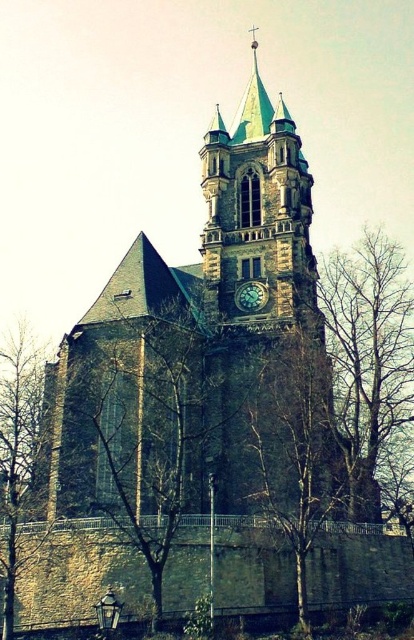
Question: Which object appears farthest from the camera in this image?

Choices:
 (A) bare wood tree at center
 (B) dark gray stone church at center

Answer: (B)

Question: From the image, what is the correct spatial relationship of dark gray stone church at center in relation to bare wood tree at center?

Choices:
 (A) above
 (B) below

Answer: (A)

Question: Among these objects, which one is nearest to the camera?

Choices:
 (A) dark gray stone church at center
 (B) green leafy tree at center
 (C) gold textured clock at center
 (D) bare wood tree at center

Answer: (B)

Question: Does bare wood tree at center have a greater width compared to bare branches at left?

Choices:
 (A) no
 (B) yes

Answer: (A)

Question: Considering the relative positions of green leafy tree at center and gold textured clock at center in the image provided, where is green leafy tree at center located with respect to gold textured clock at center?

Choices:
 (A) below
 (B) above

Answer: (A)

Question: Estimate the real-world distances between objects in this image. Which object is closer to the bare wood tree at center?

Choices:
 (A) brown textured tree at right
 (B) bare branches at left

Answer: (A)